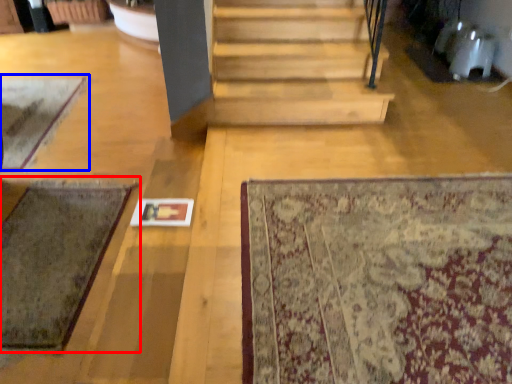
Question: Among these objects, which one is nearest to the camera, mat (highlighted by a red box) or mat (highlighted by a blue box)?

Choices:
 (A) mat
 (B) mat

Answer: (A)